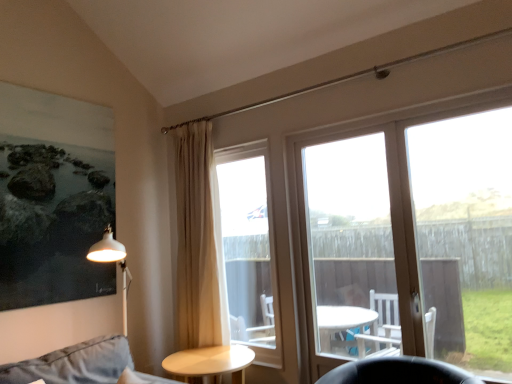
You are a GUI agent. You are given a task and a screenshot of the screen. Output one action in this format:
    pyautogui.click(x=<x>, y=<y>)
    Task: Click on the free location above light beige wooden table at center (from a real-world perspective)
    
    Given the screenshot: What is the action you would take?
    pyautogui.click(x=208, y=355)